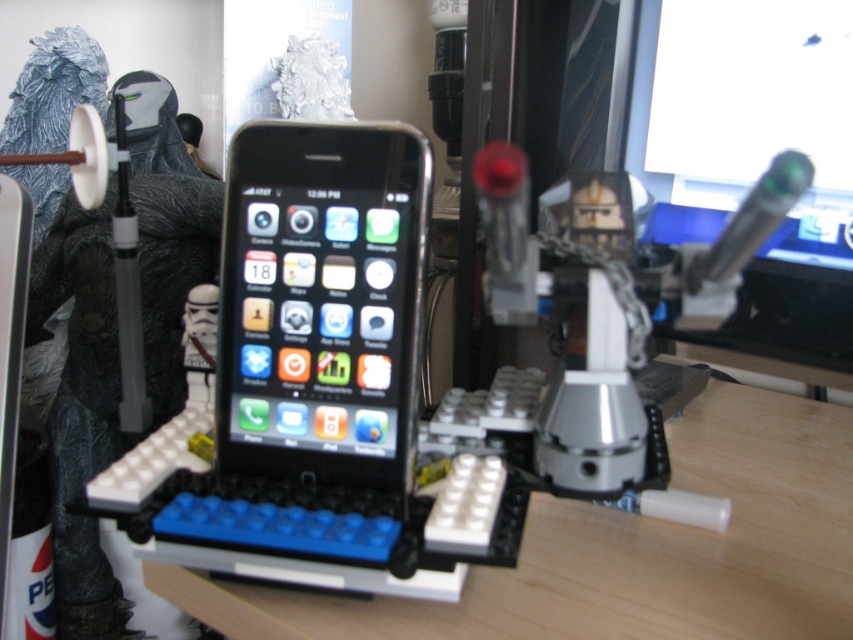
You are setting up a workspace and need to place both the wooden table at center and the matte black monitor at upper right. Given their sizes, which object should you prioritize placing first to ensure there is enough space?

The wooden table at center is larger in size than the matte black monitor at upper right, so you should prioritize placing the wooden table at center first to ensure there is enough space.

You are setting up a desk for a presentation. You have a wooden table at center and a matte black monitor at upper right. Which object should you place your laptop on to ensure it is at a comfortable viewing height?

The wooden table at center has a lesser height compared to the matte black monitor at upper right. To ensure a comfortable viewing height, you should place your laptop on the matte black monitor at upper right since it is taller than the wooden table at center.

You are setting up a display for a tech exhibition. You have a black glossy smartphone at center and a matte black monitor at upper right. Based on their positions, which object would be more visible to visitors approaching from the front of the display?

The black glossy smartphone at center would be more visible to visitors approaching from the front of the display because it is positioned in front of the matte black monitor at upper right, making it the first object in their line of sight.